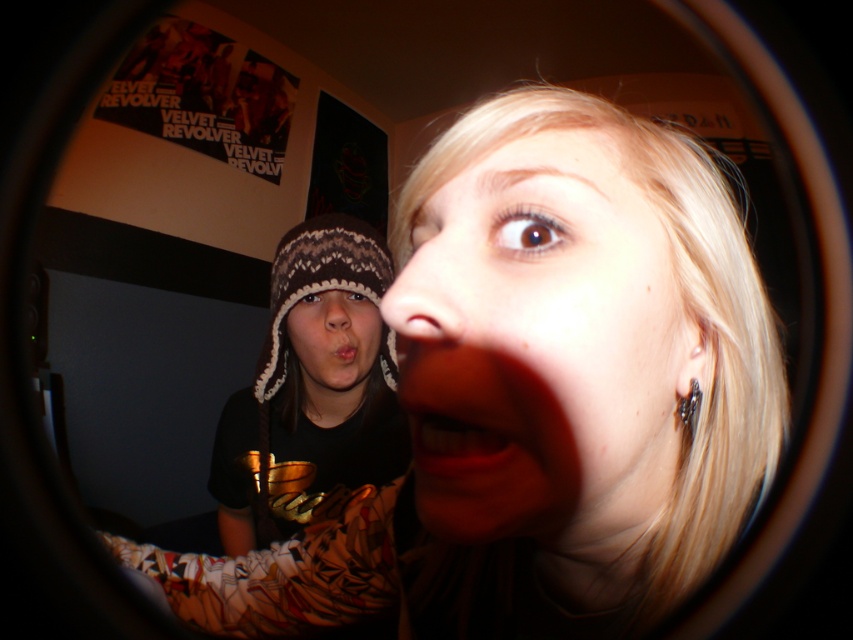
Question: Among these points, which one is nearest to the camera?

Choices:
 (A) (491, 417)
 (B) (502, 292)

Answer: (A)

Question: Is smooth skin face at center positioned before smooth matte red lips at center?

Choices:
 (A) no
 (B) yes

Answer: (B)

Question: Does knitted woolen hat at center come behind silver metallic earring at lower right?

Choices:
 (A) no
 (B) yes

Answer: (B)

Question: Among these objects, which one is farthest from the camera?

Choices:
 (A) silver metallic earring at lower right
 (B) pink matte lips at center
 (C) smooth skin face at center

Answer: (B)

Question: Does matte black hat at upper left have a greater width compared to silver metallic earring at lower right?

Choices:
 (A) yes
 (B) no

Answer: (A)

Question: Estimate the real-world distances between objects in this image. Which object is closer to the knitted woolen hat at center?

Choices:
 (A) smooth skin face at center
 (B) pink matte lips at center
 (C) smooth matte red lips at center

Answer: (B)